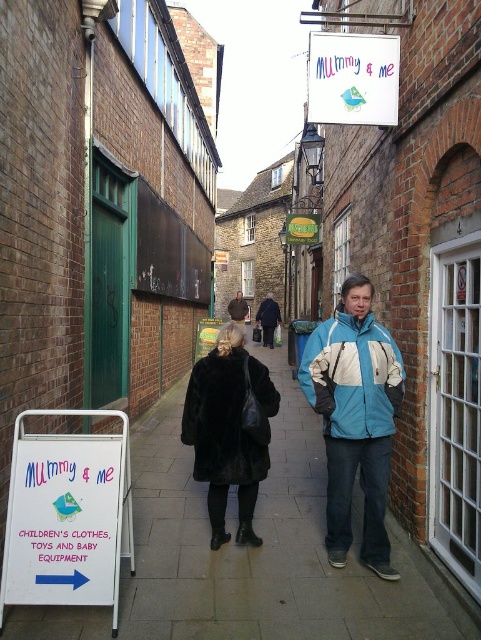
Question: Is the position of smooth concrete pavement at center less distant than that of black fur coat at center?

Choices:
 (A) no
 (B) yes

Answer: (B)

Question: Does blue/white jacket at center have a greater width compared to dark brown leather jacket at center?

Choices:
 (A) no
 (B) yes

Answer: (A)

Question: Is smooth concrete pavement at center wider than velvet black coat at center?

Choices:
 (A) yes
 (B) no

Answer: (B)

Question: Which of the following is the farthest from the observer?

Choices:
 (A) (265, 344)
 (B) (345, 524)

Answer: (A)

Question: Which point is closer to the camera?

Choices:
 (A) (339, 490)
 (B) (262, 330)

Answer: (A)

Question: Which object is closer to the camera taking this photo?

Choices:
 (A) smooth concrete pavement at center
 (B) dark brown leather jacket at center
 (C) black fur coat at center
 (D) dark blue jacket at center

Answer: (A)